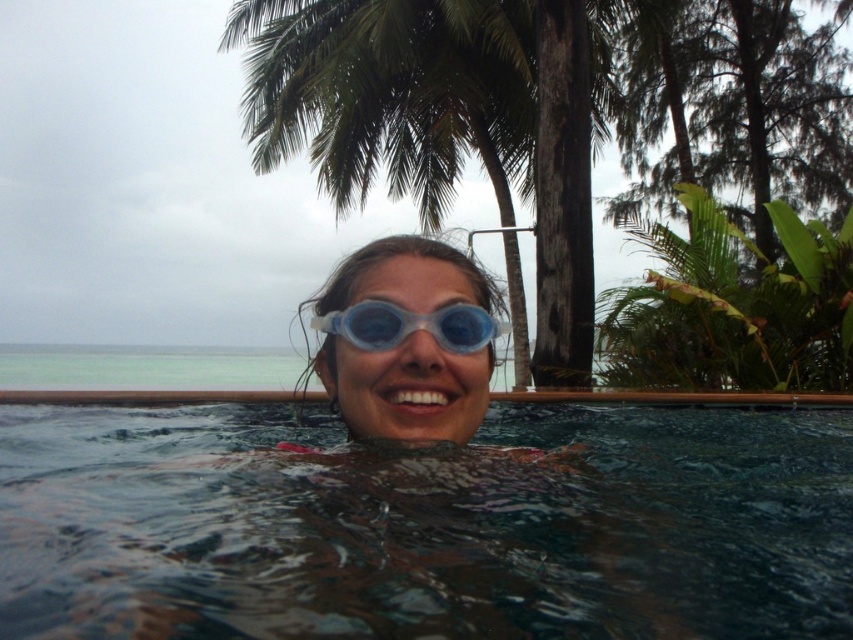
You are standing at the edge of the infinity pool and want to look at the green leafy palm tree at upper center. In which general direction should you face to see it?

The green leafy palm tree at upper center is located at point (x=439, y=122), which is in the upper center direction from your position at the pool edge. Face towards the upper center to see it.

You are a photographer positioned at the edge of the infinity pool. You want to take a photo that includes both the point at coordinates point (579,122) and point (425,314). Which point should you focus on first to ensure both are in sharp focus?

You should focus on point (579,122) first because it is closer to the camera than point (425,314). This ensures that both points will be in focus when using depth of field appropriately.